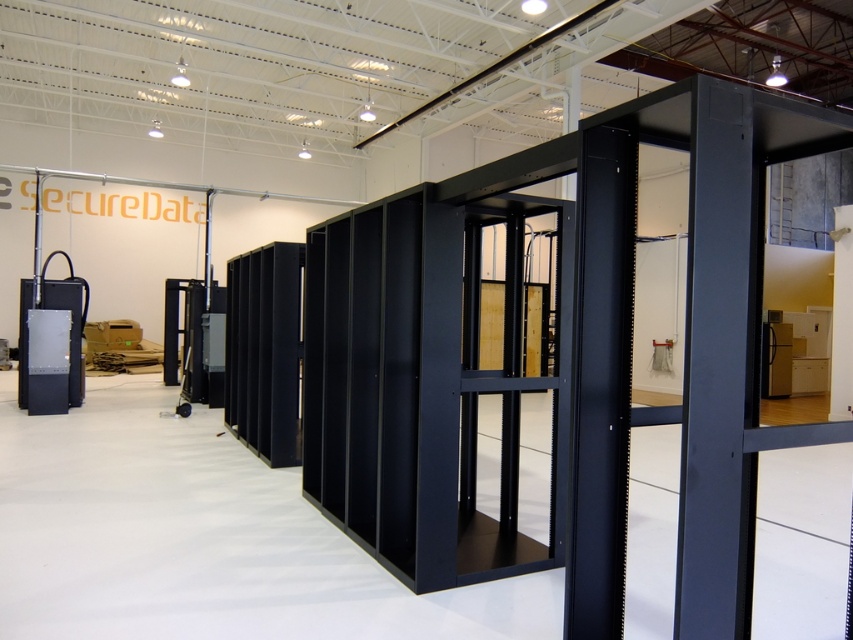
Can you confirm if transparent glass door at center is thinner than black metallic sensor at left?

No, transparent glass door at center is not thinner than black metallic sensor at left.

Which is in front, point (550, 205) or point (28, 310)?

Positioned in front is point (550, 205).

The image size is (853, 640). I want to click on transparent glass door at center, so click(514, 384).